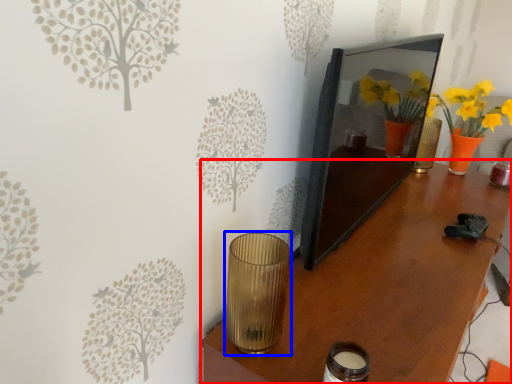
Question: Among these objects, which one is farthest to the camera, table (highlighted by a red box) or candle holder (highlighted by a blue box)?

Choices:
 (A) table
 (B) candle holder

Answer: (B)